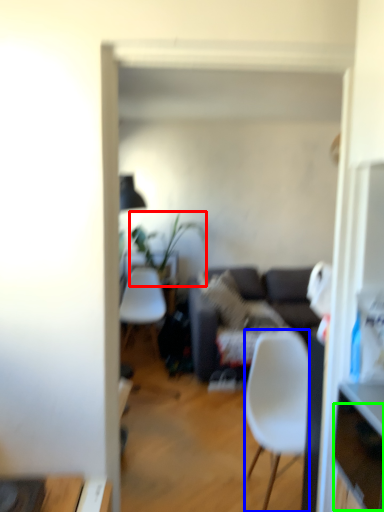
Question: Which object is the closest to the houseplant (highlighted by a red box)? Choose among these: chair (highlighted by a blue box) or drawer (highlighted by a green box).

Choices:
 (A) chair
 (B) drawer

Answer: (A)